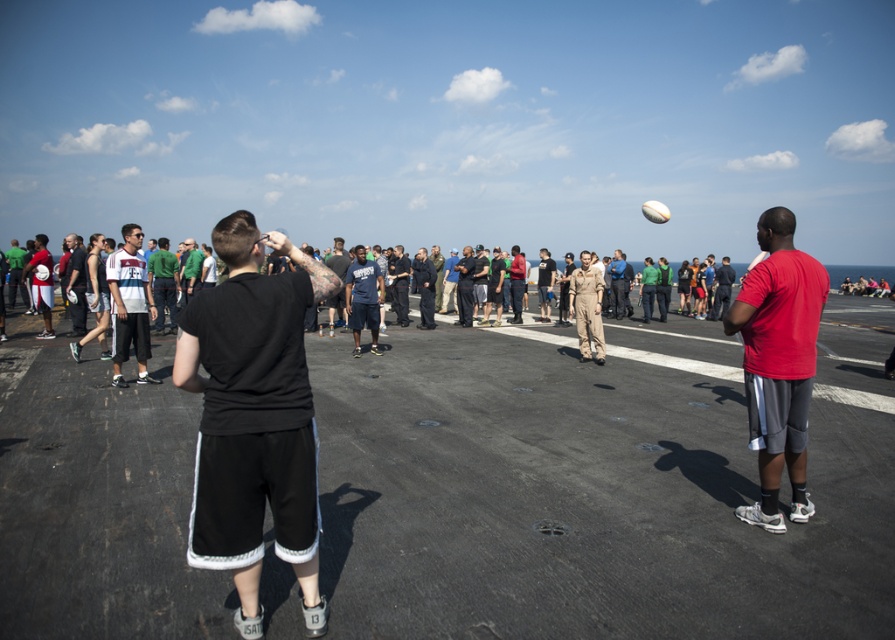
You are a photographer on the ship deck. You need to capture a photo where the red matte shirt at right and the green fabric shirt at center are both visible. Which shirt should you focus on first to ensure both are in frame?

You should focus on the green fabric shirt at center first because it is taller than the red matte shirt at right, ensuring both are visible in the frame.

What are the coordinates of the red matte shirt at right?

The coordinates of the red matte shirt at right are at point (778, 362).